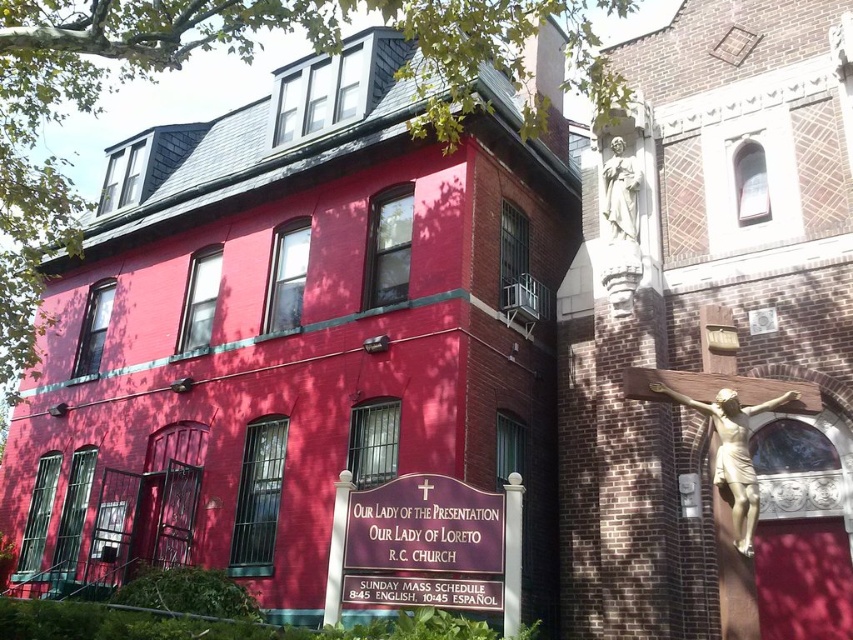
Question: Which point is closer to the camera?

Choices:
 (A) (596, 157)
 (B) (724, 428)
 (C) (637, 214)
 (D) (537, 61)

Answer: (B)

Question: Estimate the real-world distances between objects in this image. Which object is farther from the white marble statue at upper right?

Choices:
 (A) gold statue of jesus at center
 (B) metallic gold cross at center
 (C) gold metallic crucifix at right
 (D) smooth brick chapel at center

Answer: (A)

Question: Is gold statue of jesus at center wider than metallic gold cross at center?

Choices:
 (A) no
 (B) yes

Answer: (A)

Question: Does smooth brick chapel at center have a larger size compared to gold statue of jesus at center?

Choices:
 (A) no
 (B) yes

Answer: (B)

Question: Does gold metallic crucifix at right have a lesser width compared to metallic gold cross at center?

Choices:
 (A) no
 (B) yes

Answer: (A)

Question: Which point is farther from the camera taking this photo?

Choices:
 (A) (258, 161)
 (B) (425, 496)
 (C) (614, 154)

Answer: (A)